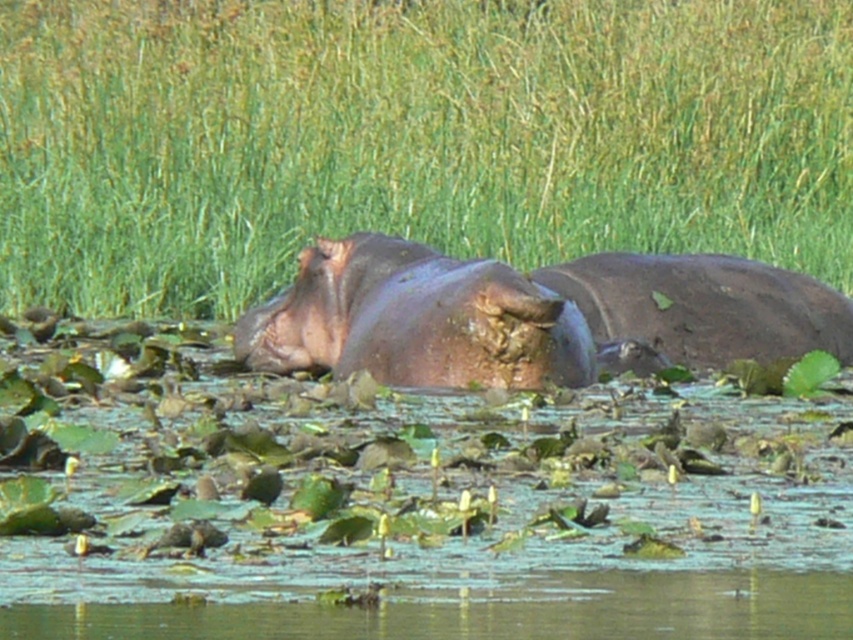
Does clear water at lower center lie behind brown matte hippo at center?

No, clear water at lower center is in front of brown matte hippo at center.

How distant is clear water at lower center from brown matte hippo at center?

clear water at lower center is 5.60 meters from brown matte hippo at center.

You are a GUI agent. You are given a task and a screenshot of the screen. Output one action in this format:
    pyautogui.click(x=<x>, y=<y>)
    Task: Click on the clear water at lower center
    
    Given the screenshot: What is the action you would take?
    pyautogui.click(x=490, y=611)

Is green grass at upper center below muddy skin hippo at center?

Incorrect, green grass at upper center is not positioned below muddy skin hippo at center.

Who is more forward, (196, 186) or (463, 288)?

Positioned in front is point (463, 288).

Who is more distant from viewer, (283, 195) or (433, 292)?

The point (283, 195) is more distant.

Locate an element on the screen. Image resolution: width=853 pixels, height=640 pixels. green grass at upper center is located at coordinates (409, 138).

Which is more to the left, muddy skin hippo at center or brown matte hippo at center?

From the viewer's perspective, muddy skin hippo at center appears more on the left side.

Can you confirm if muddy skin hippo at center is bigger than brown matte hippo at center?

Yes.

Where is `muddy skin hippo at center`? This screenshot has height=640, width=853. muddy skin hippo at center is located at coordinates (416, 321).